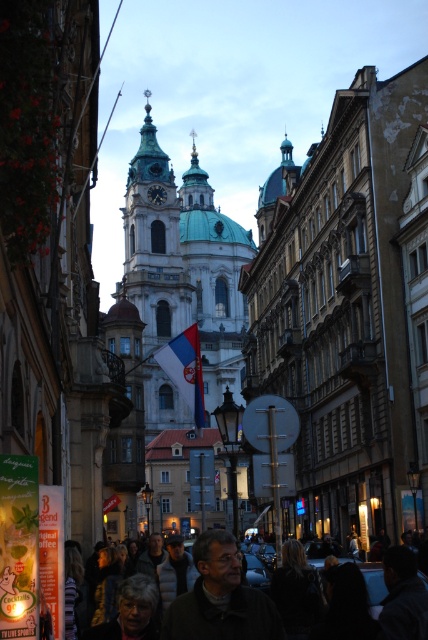
Question: Which object appears farthest from the camera in this image?

Choices:
 (A) white stone tower at center
 (B) dark gray wool coat at center

Answer: (A)

Question: Which point appears closest to the camera in this image?

Choices:
 (A) (282, 595)
 (B) (190, 612)

Answer: (B)

Question: Which of the following is the farthest from the observer?

Choices:
 (A) (130, 204)
 (B) (219, 556)
 (C) (297, 563)
 (D) (196, 360)

Answer: (A)

Question: Observing the image, what is the correct spatial positioning of white stone tower at center in reference to dark gray wool coat at center?

Choices:
 (A) left
 (B) right

Answer: (A)

Question: Does white stone tower at center have a lesser width compared to white fabric flag at center?

Choices:
 (A) no
 (B) yes

Answer: (A)

Question: Can you confirm if dark gray wool coat at center is bigger than white fabric flag at center?

Choices:
 (A) no
 (B) yes

Answer: (A)